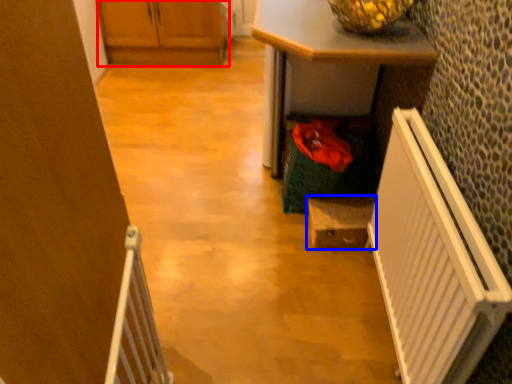
Question: Which of the following is the farthest to the observer, cabinetry (highlighted by a red box) or cabinetry (highlighted by a blue box)?

Choices:
 (A) cabinetry
 (B) cabinetry

Answer: (A)